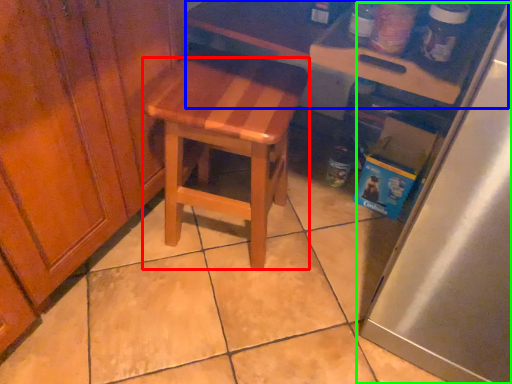
Question: Considering the real-world distances, which object is farthest from stool (highlighted by a red box)? table (highlighted by a blue box) or appliance (highlighted by a green box)?

Choices:
 (A) table
 (B) appliance

Answer: (B)